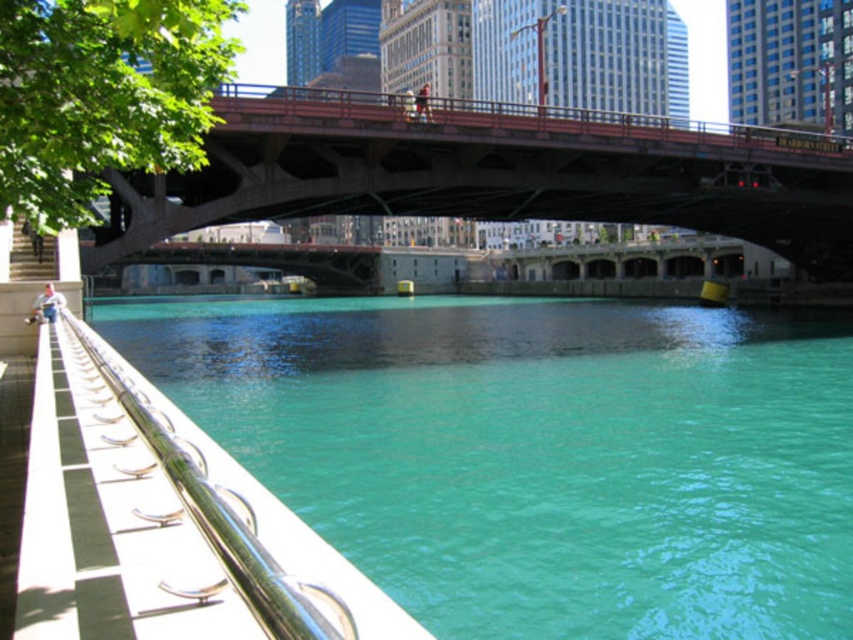
You are a construction worker tasked with placing a safety barrier between the teal glossy water at center and the concrete bridge at center. The barrier requires a minimum of 30 feet of space to be installed properly. Based on the scene, is there enough space to install the barrier?

The distance between the teal glossy water at center and the concrete bridge at center is 36.88 feet, which exceeds the required 30 feet. Therefore, there is sufficient space to install the safety barrier properly.

You are a photographer planning to capture the entire scene of the teal glossy water at center and the concrete bridge at center in one shot. Based on their relative sizes, which object should appear smaller in the final photograph?

The teal glossy water at center should appear smaller in the photograph because it is shorter than the concrete bridge at center.